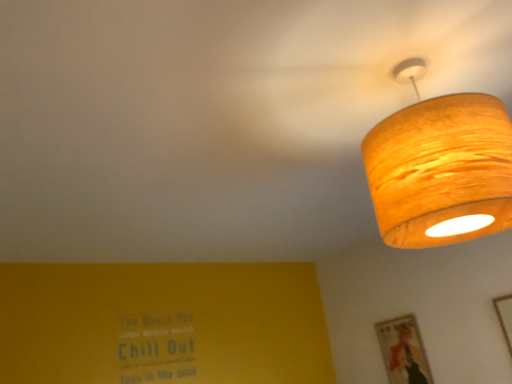
What is the approximate width of wooden textured lampshade at upper right?

The width of wooden textured lampshade at upper right is 14.74 inches.

What do you see at coordinates (505, 317) in the screenshot?
I see `wooden picture frame at upper right, which ranks as the 1th picture frame in front-to-back order` at bounding box center [505, 317].

You are a GUI agent. You are given a task and a screenshot of the screen. Output one action in this format:
    pyautogui.click(x=<x>, y=<y>)
    Task: Click on the wooden textured picture frame at lower right, placed as the 1th picture frame when sorted from left to right
    Image resolution: width=512 pixels, height=384 pixels.
    Given the screenshot: What is the action you would take?
    pyautogui.click(x=403, y=351)

Where is `wooden textured lampshade at upper right`? The width and height of the screenshot is (512, 384). wooden textured lampshade at upper right is located at coordinates tap(440, 168).

How different are the orientations of wooden textured picture frame at lower right, positioned as the second picture frame in front-to-back order, and wooden textured lampshade at upper right in degrees?

The angular difference between wooden textured picture frame at lower right, positioned as the second picture frame in front-to-back order, and wooden textured lampshade at upper right is 3.21 degrees.

Which object is thinner, wooden textured picture frame at lower right, marked as the first picture frame in a back-to-front arrangement, or wooden textured lampshade at upper right?

wooden textured picture frame at lower right, marked as the first picture frame in a back-to-front arrangement.

In terms of height, does wooden textured picture frame at lower right, positioned as the second picture frame in front-to-back order, look taller or shorter compared to wooden textured lampshade at upper right?

Clearly, wooden textured picture frame at lower right, positioned as the second picture frame in front-to-back order, is shorter compared to wooden textured lampshade at upper right.

Considering the relative sizes of wooden textured picture frame at lower right, marked as the first picture frame in a back-to-front arrangement, and wooden textured lampshade at upper right in the image provided, is wooden textured picture frame at lower right, marked as the first picture frame in a back-to-front arrangement, bigger than wooden textured lampshade at upper right?

No.

Is wooden picture frame at upper right, arranged as the 2th picture frame when viewed from the left, a part of wooden textured picture frame at lower right, marked as the first picture frame in a back-to-front arrangement?

That's incorrect, wooden picture frame at upper right, arranged as the 2th picture frame when viewed from the left, is not inside wooden textured picture frame at lower right, marked as the first picture frame in a back-to-front arrangement.

From a real-world perspective, is wooden textured picture frame at lower right, marked as the first picture frame in a back-to-front arrangement, positioned above or below wooden picture frame at upper right, which is the 2th picture frame in back-to-front order?

Clearly, from a real-world perspective, wooden textured picture frame at lower right, marked as the first picture frame in a back-to-front arrangement, is above wooden picture frame at upper right, which is the 2th picture frame in back-to-front order.

Which object is thinner, wooden textured picture frame at lower right, placed as the 1th picture frame when sorted from left to right, or wooden picture frame at upper right, which ranks as the 1th picture frame in front-to-back order?

wooden picture frame at upper right, which ranks as the 1th picture frame in front-to-back order.

Which is more to the right, wooden picture frame at upper right, which is the 2th picture frame in back-to-front order, or wooden textured picture frame at lower right, placed as the 1th picture frame when sorted from left to right?

wooden picture frame at upper right, which is the 2th picture frame in back-to-front order.

Locate an element on the screen. picture frame above the wooden picture frame at upper right, arranged as the 2th picture frame when viewed from the left (from a real-world perspective) is located at coordinates (403, 351).

Is wooden picture frame at upper right, which ranks as the 1th picture frame in front-to-back order, far away from wooden textured picture frame at lower right, marked as the first picture frame in a back-to-front arrangement?

wooden picture frame at upper right, which ranks as the 1th picture frame in front-to-back order, is actually quite close to wooden textured picture frame at lower right, marked as the first picture frame in a back-to-front arrangement.

Does wooden picture frame at upper right, the first picture frame viewed from the right, turn towards wooden textured picture frame at lower right, the second picture frame from the right?

No, wooden picture frame at upper right, the first picture frame viewed from the right, does not turn towards wooden textured picture frame at lower right, the second picture frame from the right.

Is wooden picture frame at upper right, arranged as the 2th picture frame when viewed from the left, placed right next to wooden textured lampshade at upper right?

wooden picture frame at upper right, arranged as the 2th picture frame when viewed from the left, and wooden textured lampshade at upper right are clearly separated.

Can you confirm if wooden picture frame at upper right, which is the 2th picture frame in back-to-front order, is bigger than wooden textured lampshade at upper right?

No.

From a real-world perspective, between wooden picture frame at upper right, which is the 2th picture frame in back-to-front order, and wooden textured lampshade at upper right, who is vertically lower?

In real-world perspective, wooden picture frame at upper right, which is the 2th picture frame in back-to-front order, is lower.

From a real-world perspective, starting from the wooden textured lampshade at upper right, which picture frame is the 2nd one below it? Please provide its 2D coordinates.

[(505, 317)]

Considering their positions, is wooden textured lampshade at upper right located in front of or behind wooden textured picture frame at lower right, marked as the first picture frame in a back-to-front arrangement?

wooden textured lampshade at upper right is positioned closer to the viewer than wooden textured picture frame at lower right, marked as the first picture frame in a back-to-front arrangement.

Is wooden textured lampshade at upper right looking in the opposite direction of wooden textured picture frame at lower right, placed as the 1th picture frame when sorted from left to right?

wooden textured lampshade at upper right is not turned away from wooden textured picture frame at lower right, placed as the 1th picture frame when sorted from left to right.

Can you confirm if wooden textured lampshade at upper right is positioned to the left of wooden textured picture frame at lower right, the second picture frame from the right?

Yes, wooden textured lampshade at upper right is to the left of wooden textured picture frame at lower right, the second picture frame from the right.

Does point (476, 177) come behind point (510, 310)?

No, (476, 177) is closer to viewer.

Can wooden picture frame at upper right, arranged as the 2th picture frame when viewed from the left, be found inside wooden textured lampshade at upper right?

Definitely not — wooden picture frame at upper right, arranged as the 2th picture frame when viewed from the left, is not inside wooden textured lampshade at upper right.

In the image, is wooden textured lampshade at upper right on the left side or the right side of wooden picture frame at upper right, which is the 2th picture frame in back-to-front order?

In the image, wooden textured lampshade at upper right appears on the left side of wooden picture frame at upper right, which is the 2th picture frame in back-to-front order.

Relative to wooden picture frame at upper right, which is the 2th picture frame in back-to-front order, is wooden textured lampshade at upper right in front or behind?

In the image, wooden textured lampshade at upper right appears in front of wooden picture frame at upper right, which is the 2th picture frame in back-to-front order.

Starting from the wooden textured lampshade at upper right, which picture frame is the 1st one to the right? Please provide its 2D coordinates.

[(403, 351)]

This screenshot has height=384, width=512. I want to click on picture frame above the wooden picture frame at upper right, which ranks as the 1th picture frame in front-to-back order (from a real-world perspective), so click(403, 351).

When comparing their distances from wooden picture frame at upper right, the first picture frame viewed from the right, does wooden textured lampshade at upper right or wooden textured picture frame at lower right, positioned as the second picture frame in front-to-back order, seem closer?

wooden textured picture frame at lower right, positioned as the second picture frame in front-to-back order, lies closer to wooden picture frame at upper right, the first picture frame viewed from the right, than the other object.

When comparing their distances from wooden textured picture frame at lower right, placed as the 1th picture frame when sorted from left to right, does wooden picture frame at upper right, which ranks as the 1th picture frame in front-to-back order, or wooden textured lampshade at upper right seem further?

wooden textured lampshade at upper right lies further to wooden textured picture frame at lower right, placed as the 1th picture frame when sorted from left to right, than the other object.

Looking at this image, based on their spatial positions, is wooden picture frame at upper right, which ranks as the 1th picture frame in front-to-back order, or wooden textured picture frame at lower right, placed as the 1th picture frame when sorted from left to right, closer to wooden textured lampshade at upper right?

wooden picture frame at upper right, which ranks as the 1th picture frame in front-to-back order.

Based on their spatial positions, is wooden textured picture frame at lower right, marked as the first picture frame in a back-to-front arrangement, or wooden picture frame at upper right, which ranks as the 1th picture frame in front-to-back order, closer to wooden textured lampshade at upper right?

wooden picture frame at upper right, which ranks as the 1th picture frame in front-to-back order, lies closer to wooden textured lampshade at upper right than the other object.

Considering their positions, is wooden textured picture frame at lower right, placed as the 1th picture frame when sorted from left to right, positioned further to wooden picture frame at upper right, arranged as the 2th picture frame when viewed from the left, than wooden textured lampshade at upper right?

The object further to wooden picture frame at upper right, arranged as the 2th picture frame when viewed from the left, is wooden textured lampshade at upper right.

Based on the photo, considering their positions, is wooden textured lampshade at upper right positioned further to wooden textured picture frame at lower right, placed as the 1th picture frame when sorted from left to right, than wooden picture frame at upper right, arranged as the 2th picture frame when viewed from the left?

Based on the image, wooden textured lampshade at upper right appears to be further to wooden textured picture frame at lower right, placed as the 1th picture frame when sorted from left to right.

Locate an element on the screen. This screenshot has height=384, width=512. picture frame between wooden textured lampshade at upper right and wooden textured picture frame at lower right, marked as the first picture frame in a back-to-front arrangement, in the front-back direction is located at coordinates (505, 317).